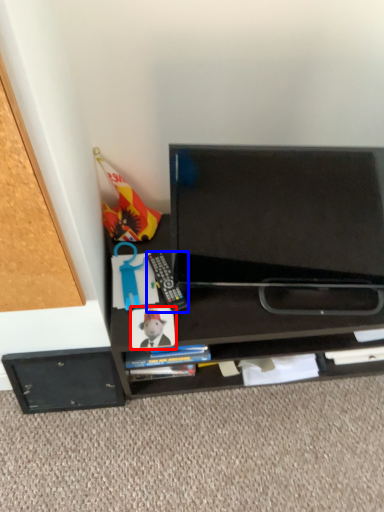
Question: Which object appears farthest to the camera in this image, paperback book (highlighted by a red box) or equipment (highlighted by a blue box)?

Choices:
 (A) paperback book
 (B) equipment

Answer: (B)